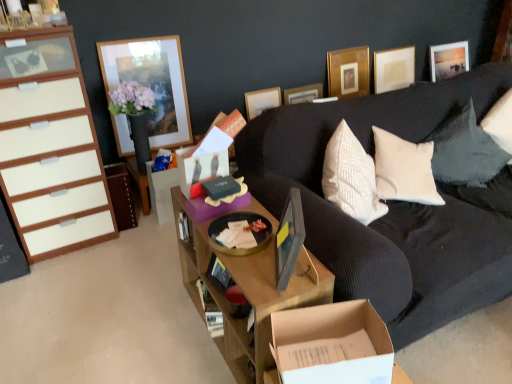
I want to click on wooden picture frame at upper center, the 2th picture frame when ordered from left to right, so click(261, 101).

Image resolution: width=512 pixels, height=384 pixels. What do you see at coordinates (261, 101) in the screenshot?
I see `wooden picture frame at upper center, the 2th picture frame when ordered from left to right` at bounding box center [261, 101].

What do you see at coordinates (122, 196) in the screenshot? I see `matte brown cabinet at left, placed as the 2th cabinetry when sorted from left to right` at bounding box center [122, 196].

Image resolution: width=512 pixels, height=384 pixels. Describe the element at coordinates (247, 288) in the screenshot. I see `wooden desk at center` at that location.

Identify the location of matte white picture frame at upper right, positioned as the fifth picture frame in left-to-right order. (394, 69).

Is black textured pillow at upper right not near cardboard box at lower center?

Indeed, black textured pillow at upper right is not near cardboard box at lower center.

Would you say black textured pillow at upper right is to the left or to the right of cardboard box at lower center in the picture?

Clearly, black textured pillow at upper right is on the right of cardboard box at lower center in the image.

Considering the points (457, 145) and (307, 340), which point is behind, point (457, 145) or point (307, 340)?

Positioned behind is point (457, 145).

How many degrees apart are the facing directions of black textured pillow at upper right and cardboard box at lower center?

The facing directions of black textured pillow at upper right and cardboard box at lower center are 6.38 degrees apart.

Considering the sizes of objects white glossy cabinet at left, the 1th cabinetry when ordered from left to right, and matte gray picture frame at center, the 1th picture frame in the front-to-back sequence, in the image provided, who is thinner, white glossy cabinet at left, the 1th cabinetry when ordered from left to right, or matte gray picture frame at center, the 1th picture frame in the front-to-back sequence,?

matte gray picture frame at center, the 1th picture frame in the front-to-back sequence, is thinner.

How many degrees apart are the facing directions of white glossy cabinet at left, the 1th cabinetry when ordered from left to right, and matte gray picture frame at center, which ranks as the 6th picture frame in back-to-front order?

The angle between the facing direction of white glossy cabinet at left, the 1th cabinetry when ordered from left to right, and the facing direction of matte gray picture frame at center, which ranks as the 6th picture frame in back-to-front order, is 123 degrees.

Does white glossy cabinet at left, acting as the second cabinetry starting from the right, appear on the right side of matte gray picture frame at center, the 1th picture frame in the front-to-back sequence?

No, white glossy cabinet at left, acting as the second cabinetry starting from the right, is not to the right of matte gray picture frame at center, the 1th picture frame in the front-to-back sequence.

From a real-world perspective, is white glossy cabinet at left, the 1th cabinetry when ordered from left to right, over matte gray picture frame at center, the fourth picture frame in the right-to-left sequence?

Actually, white glossy cabinet at left, the 1th cabinetry when ordered from left to right, is physically below matte gray picture frame at center, the fourth picture frame in the right-to-left sequence, in the real world.

Is matte white picture frame at upper right, the second picture frame in the back-to-front sequence, completely or partially outside of matte wooden picture frame at upper right, marked as the first picture frame in a back-to-front arrangement?

That's correct, matte white picture frame at upper right, the second picture frame in the back-to-front sequence, is outside of matte wooden picture frame at upper right, marked as the first picture frame in a back-to-front arrangement.

From the image's perspective, is matte white picture frame at upper right, the second picture frame in the back-to-front sequence, located above or below matte wooden picture frame at upper right, the first picture frame positioned from the right?

matte white picture frame at upper right, the second picture frame in the back-to-front sequence, is below matte wooden picture frame at upper right, the first picture frame positioned from the right.

Is point (405, 87) behind point (464, 49)?

No, (405, 87) is closer to viewer.

Which object is more forward, matte white picture frame at upper right, which ranks as the 2th picture frame in right-to-left order, or matte wooden picture frame at upper right, the first picture frame positioned from the right?

matte white picture frame at upper right, which ranks as the 2th picture frame in right-to-left order, is in front.

Can you confirm if matte white picture frame at upper right, positioned as the fifth picture frame in left-to-right order, is thinner than matte gray picture frame at center, the fourth picture frame in the right-to-left sequence?

Correct, the width of matte white picture frame at upper right, positioned as the fifth picture frame in left-to-right order, is less than that of matte gray picture frame at center, the fourth picture frame in the right-to-left sequence.

From a real-world perspective, is matte white picture frame at upper right, marked as the fifth picture frame in a front-to-back arrangement, positioned under matte gray picture frame at center, the 3th picture frame when ordered from left to right, based on gravity?

Yes, from a real-world perspective, matte white picture frame at upper right, marked as the fifth picture frame in a front-to-back arrangement, is beneath matte gray picture frame at center, the 3th picture frame when ordered from left to right.

From the image's perspective, relative to matte gray picture frame at center, the 1th picture frame in the front-to-back sequence, is matte white picture frame at upper right, the second picture frame in the back-to-front sequence, above or below?

matte white picture frame at upper right, the second picture frame in the back-to-front sequence, is situated higher than matte gray picture frame at center, the 1th picture frame in the front-to-back sequence, in the image.

Consider the image. Considering the relative sizes of cardboard box at lower center and matte gray picture frame at center, the fourth picture frame in the right-to-left sequence, in the image provided, is cardboard box at lower center taller than matte gray picture frame at center, the fourth picture frame in the right-to-left sequence,?

Incorrect, the height of cardboard box at lower center is not larger of that of matte gray picture frame at center, the fourth picture frame in the right-to-left sequence.

Would you consider cardboard box at lower center to be distant from matte gray picture frame at center, which ranks as the 6th picture frame in back-to-front order?

No, cardboard box at lower center is in close proximity to matte gray picture frame at center, which ranks as the 6th picture frame in back-to-front order.

From a real-world perspective, which is physically below, cardboard box at lower center or matte gray picture frame at center, which ranks as the 6th picture frame in back-to-front order?

cardboard box at lower center is physically lower.

Is cardboard box at lower center not inside matte gray picture frame at center, the fourth picture frame in the right-to-left sequence?

Yes, cardboard box at lower center is not within matte gray picture frame at center, the fourth picture frame in the right-to-left sequence.

Is black textured pillow at upper right with white glossy cabinet at left, the 1th cabinetry when ordered from left to right?

No, black textured pillow at upper right is not in contact with white glossy cabinet at left, the 1th cabinetry when ordered from left to right.

Measure the distance between black textured pillow at upper right and white glossy cabinet at left, acting as the second cabinetry starting from the right.

black textured pillow at upper right and white glossy cabinet at left, acting as the second cabinetry starting from the right, are 1.99 meters apart.

Who is shorter, black textured pillow at upper right or white glossy cabinet at left, acting as the second cabinetry starting from the right?

black textured pillow at upper right.

How many degrees apart are the facing directions of black textured pillow at upper right and white glossy cabinet at left, the 1th cabinetry when ordered from left to right?

The angle between the facing direction of black textured pillow at upper right and the facing direction of white glossy cabinet at left, the 1th cabinetry when ordered from left to right, is 18.8 degrees.

Considering the relative positions of matte gray picture frame at center, the 3th picture frame when ordered from left to right, and matte wooden picture frame at upper right, marked as the first picture frame in a back-to-front arrangement, in the image provided, is matte gray picture frame at center, the 3th picture frame when ordered from left to right, to the right of matte wooden picture frame at upper right, marked as the first picture frame in a back-to-front arrangement, from the viewer's perspective?

In fact, matte gray picture frame at center, the 3th picture frame when ordered from left to right, is to the left of matte wooden picture frame at upper right, marked as the first picture frame in a back-to-front arrangement.

Is matte gray picture frame at center, the fourth picture frame in the right-to-left sequence, turned away from matte wooden picture frame at upper right, arranged as the sixth picture frame when viewed from the left?

→ That's not correct — matte gray picture frame at center, the fourth picture frame in the right-to-left sequence, is not looking away from matte wooden picture frame at upper right, arranged as the sixth picture frame when viewed from the left.

From a real-world perspective, is matte gray picture frame at center, the 1th picture frame in the front-to-back sequence, physically located above or below matte wooden picture frame at upper right, the first picture frame positioned from the right?

From a real-world perspective, matte gray picture frame at center, the 1th picture frame in the front-to-back sequence, is physically above matte wooden picture frame at upper right, the first picture frame positioned from the right.

From the image's perspective, is matte gray picture frame at center, the fourth picture frame in the right-to-left sequence, under matte wooden picture frame at upper right, arranged as the sixth picture frame when viewed from the left?

Yes, from the image's perspective, matte gray picture frame at center, the fourth picture frame in the right-to-left sequence, is beneath matte wooden picture frame at upper right, arranged as the sixth picture frame when viewed from the left.

Where is `cardboard box below the black textured pillow at upper right (from a real-world perspective)`? cardboard box below the black textured pillow at upper right (from a real-world perspective) is located at coordinates coord(332,344).

From the image's perspective, which cabinetry is the 2nd one above the matte gray picture frame at center, the 3th picture frame when ordered from left to right? Please provide its 2D coordinates.

[(50, 146)]

Looking at the image, which one is located further to cardboard box at lower center, matte white picture frame at upper right, the second picture frame in the back-to-front sequence, or gold metallic picture frame at upper center, the fourth picture frame when ordered from left to right?

matte white picture frame at upper right, the second picture frame in the back-to-front sequence, lies further to cardboard box at lower center than the other object.

Considering their positions, is black textured pillow at upper right positioned closer to wooden picture frame at upper left, marked as the first picture frame in a left-to-right arrangement, than cardboard box at lower center?

The object closer to wooden picture frame at upper left, marked as the first picture frame in a left-to-right arrangement, is black textured pillow at upper right.

Looking at the image, which one is located closer to wooden desk at center, cardboard box at lower center or black textured pillow at upper right?

cardboard box at lower center lies closer to wooden desk at center than the other object.

Estimate the real-world distances between objects in this image. Which object is further from cardboard box at lower center, gold metallic picture frame at upper center, the fourth picture frame when ordered from left to right, or matte gray picture frame at center, the fourth picture frame in the right-to-left sequence?

gold metallic picture frame at upper center, the fourth picture frame when ordered from left to right, is positioned further to the anchor cardboard box at lower center.

From the picture: Looking at the image, which one is located closer to matte brown cabinet at left, placed as the 2th cabinetry when sorted from left to right, black textured pillow at upper right or cardboard box at lower center?

cardboard box at lower center.

When comparing their distances from wooden picture frame at upper center, the 4th picture frame from the back, does matte wooden picture frame at upper right, marked as the first picture frame in a back-to-front arrangement, or wooden picture frame at upper left, the second picture frame in the front-to-back sequence, seem further?

matte wooden picture frame at upper right, marked as the first picture frame in a back-to-front arrangement, is positioned further to the anchor wooden picture frame at upper center, the 4th picture frame from the back.

Based on their spatial positions, is wooden picture frame at upper center, placed as the 5th picture frame when sorted from right to left, or black textured pillow at upper right closer to gold metallic picture frame at upper center, the fourth picture frame when ordered from left to right?

wooden picture frame at upper center, placed as the 5th picture frame when sorted from right to left, lies closer to gold metallic picture frame at upper center, the fourth picture frame when ordered from left to right, than the other object.

Looking at the image, which one is located closer to matte white picture frame at upper right, the second picture frame in the back-to-front sequence, matte wooden picture frame at upper right, the first picture frame positioned from the right, or gold metallic picture frame at upper center, acting as the 4th picture frame starting from the front?

gold metallic picture frame at upper center, acting as the 4th picture frame starting from the front.

Where is `desk between matte gray picture frame at center, the 3th picture frame when ordered from left to right, and matte brown cabinet at left, which is the first cabinetry in right-to-left order, along the z-axis`? Image resolution: width=512 pixels, height=384 pixels. desk between matte gray picture frame at center, the 3th picture frame when ordered from left to right, and matte brown cabinet at left, which is the first cabinetry in right-to-left order, along the z-axis is located at coordinates 247,288.

I want to click on picture frame between matte gray picture frame at center, which ranks as the 6th picture frame in back-to-front order, and wooden picture frame at upper center, the 4th picture frame from the back, in the front-back direction, so [152, 83].

I want to click on cabinetry situated between white glossy cabinet at left, the 1th cabinetry when ordered from left to right, and matte wooden picture frame at upper right, marked as the first picture frame in a back-to-front arrangement, from left to right, so click(122, 196).

The height and width of the screenshot is (384, 512). What are the coordinates of `cabinetry situated between white glossy cabinet at left, acting as the second cabinetry starting from the right, and wooden desk at center from left to right` in the screenshot? It's located at (122, 196).